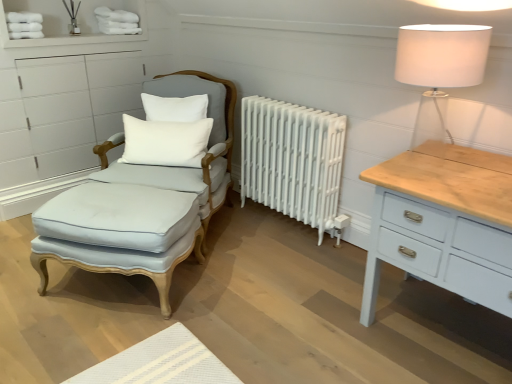
Image resolution: width=512 pixels, height=384 pixels. What are the coordinates of `vacant space that's between light blue fabric swivel chair at left and white painted metal radiator at center` in the screenshot? It's located at (263, 240).